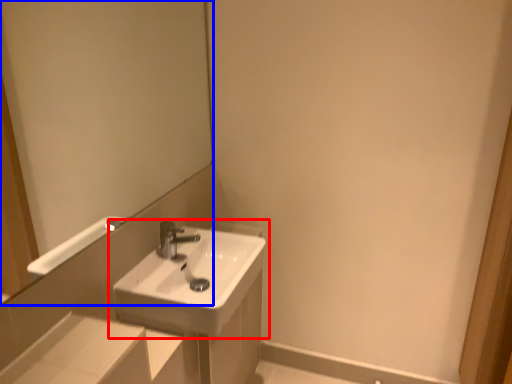
Question: Which of the following is the closest to the observer, sink (highlighted by a red box) or mirror (highlighted by a blue box)?

Choices:
 (A) sink
 (B) mirror

Answer: (B)